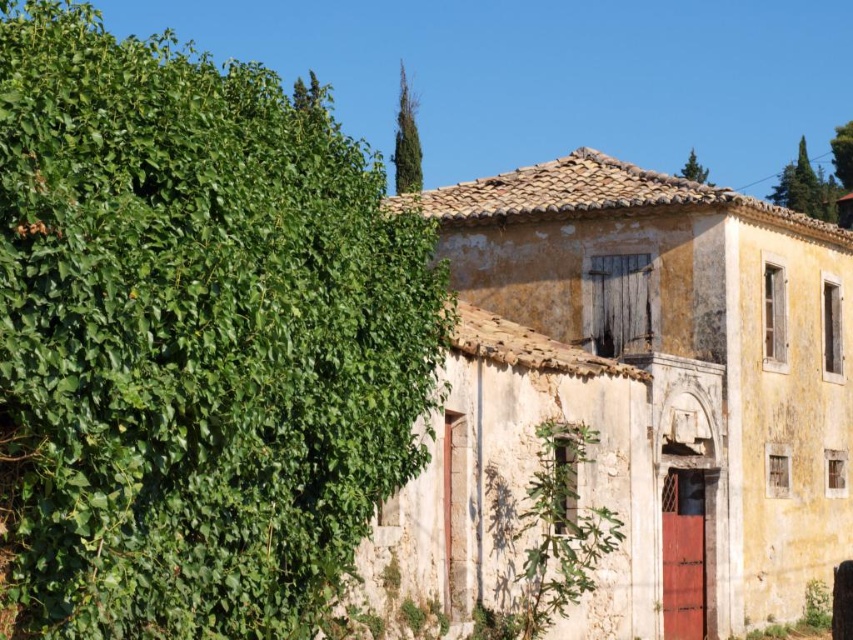
Can you confirm if green leafy hedge at left is positioned to the right of yellowish plaster building at center?

Incorrect, green leafy hedge at left is not on the right side of yellowish plaster building at center.

Who is more distant from viewer, (233, 452) or (727, 193)?

The point (727, 193) is more distant.

Image resolution: width=853 pixels, height=640 pixels. Identify the location of green leafy hedge at left. (195, 339).